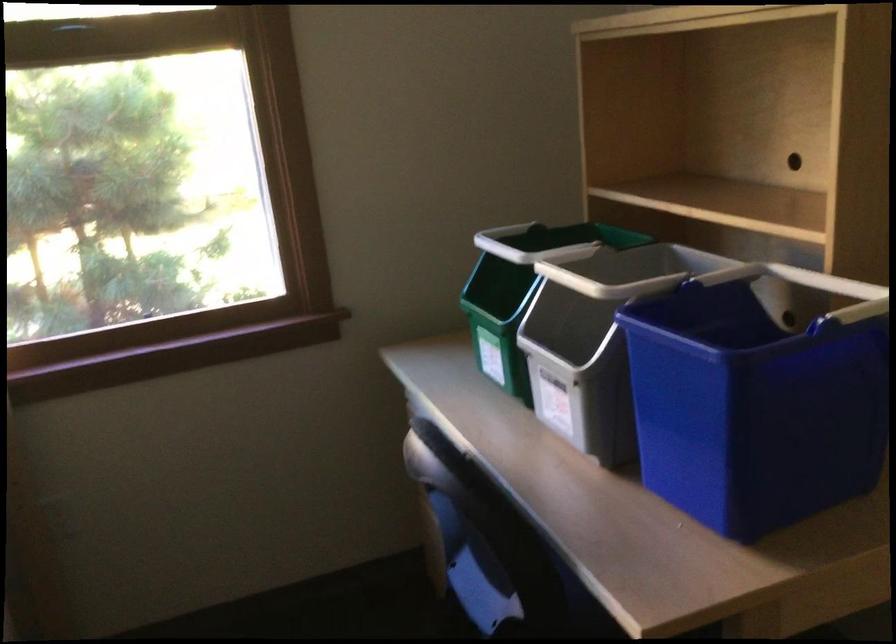
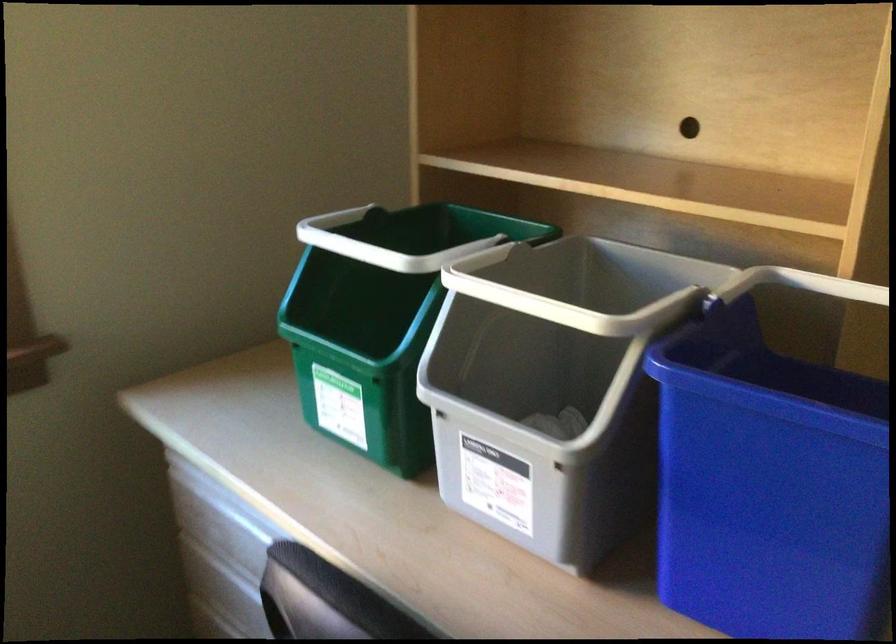
What movement of the cameraman would produce the second image?

The cameraman walked toward left, forward.